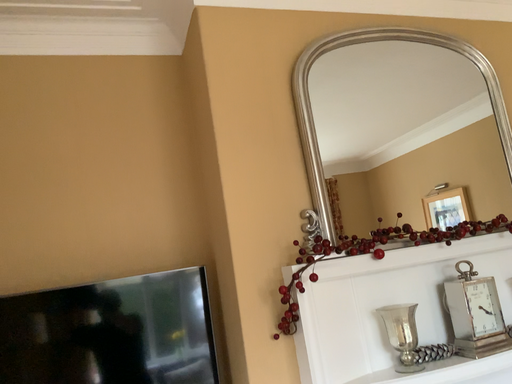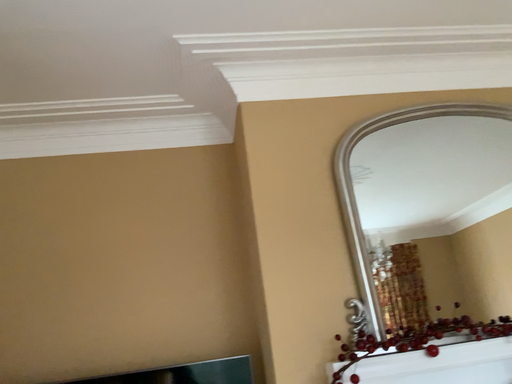
Question: How did the camera likely rotate when shooting the video?

Choices:
 (A) rotated upward
 (B) rotated downward

Answer: (A)